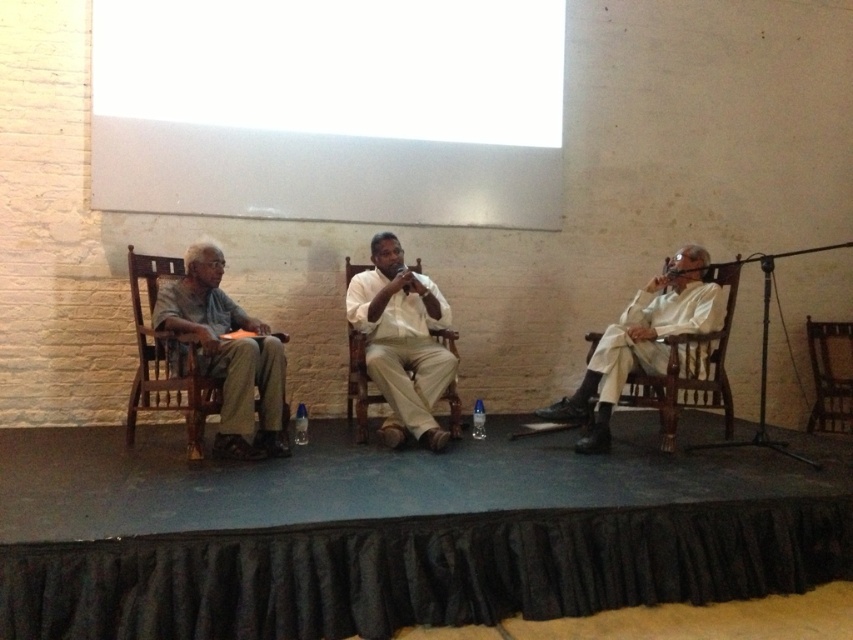
Question: Which point is farther from the camera taking this photo?

Choices:
 (A) (386, 378)
 (B) (822, 344)
 (C) (676, 280)
 (D) (146, 376)

Answer: (B)

Question: Which point is farther to the camera?

Choices:
 (A) wooden chair at center
 (B) wooden at right

Answer: (B)

Question: Does wooden chair at left appear under wooden chair at center?

Choices:
 (A) yes
 (B) no

Answer: (A)

Question: Can you confirm if wooden chair at left is wider than wooden at center?

Choices:
 (A) yes
 (B) no

Answer: (A)

Question: Can you confirm if wooden chair at center is positioned to the right of wooden at center?

Choices:
 (A) no
 (B) yes

Answer: (A)

Question: Which of the following is the farthest from the observer?

Choices:
 (A) (664, 369)
 (B) (209, 275)
 (C) (816, 368)
 (D) (412, 308)

Answer: (C)